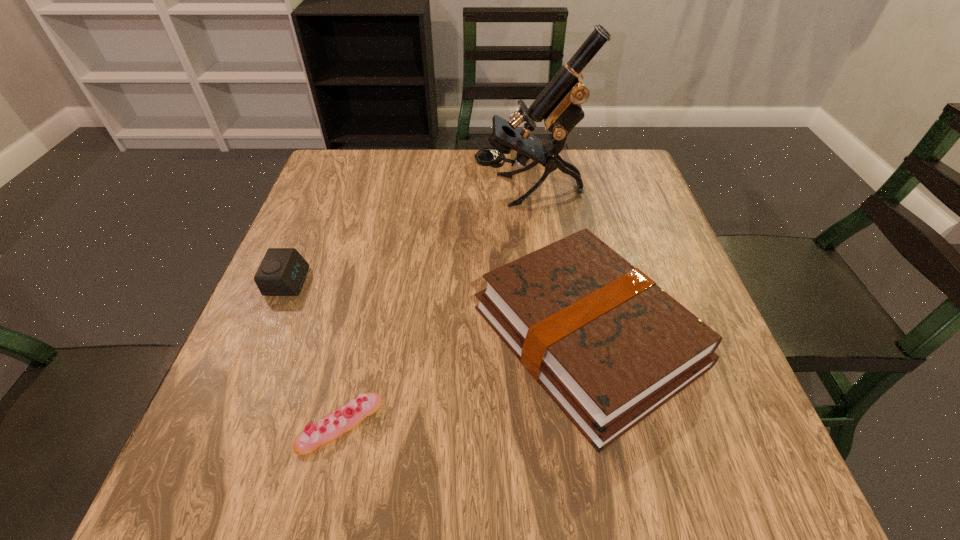
I want to click on blank area located on the left of the second tallest object, so click(x=352, y=336).

The width and height of the screenshot is (960, 540). Find the location of `free space located on the front-facing side of the leftmost object`. free space located on the front-facing side of the leftmost object is located at coordinates (457, 282).

Identify the location of vacant region located 0.260m on the back of the eclair. (372, 283).

Where is `object that is at the far edge`? object that is at the far edge is located at coordinates (559, 104).

Locate an element on the screen. This screenshot has width=960, height=540. hardback book located in the near edge section of the desktop is located at coordinates (610, 347).

You are a GUI agent. You are given a task and a screenshot of the screen. Output one action in this format:
    pyautogui.click(x=<x>, y=<y>)
    Task: Click on the eclair located at the near edge
    The height and width of the screenshot is (540, 960).
    Given the screenshot: What is the action you would take?
    pyautogui.click(x=331, y=427)

Locate an element on the screen. Image resolution: width=960 pixels, height=540 pixels. alarm clock that is positioned at the left edge is located at coordinates (282, 272).

Identify the location of eclair that is at the left edge. (331, 427).

At what (x,y) coordinates should I click in order to perform the action: click on object that is at the right edge. Please return your answer as a coordinate pair (x, y). The image size is (960, 540). Looking at the image, I should click on (610, 347).

Locate an element on the screen. object that is at the near left corner is located at coordinates (331, 427).